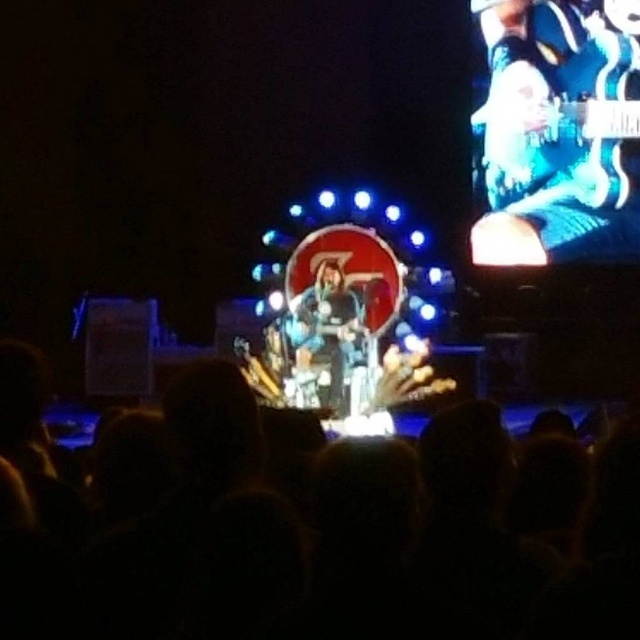
Question: Can you confirm if blue metallic guitar at upper right is positioned to the left of shiny black guitar at center?

Choices:
 (A) yes
 (B) no

Answer: (B)

Question: Among these objects, which one is farthest from the camera?

Choices:
 (A) silhouette hair at center
 (B) blue metallic guitar at upper right

Answer: (B)

Question: Does blue metallic guitar at upper right have a lesser width compared to shiny black guitar at center?

Choices:
 (A) no
 (B) yes

Answer: (A)

Question: Can you confirm if blue metallic guitar at upper right is positioned to the right of shiny black guitar at center?

Choices:
 (A) no
 (B) yes

Answer: (B)

Question: Considering the real-world distances, which object is farthest from the shiny black guitar at center?

Choices:
 (A) silhouette hair at center
 (B) blue metallic guitar at upper right

Answer: (B)

Question: Among these objects, which one is farthest from the camera?

Choices:
 (A) shiny black guitar at center
 (B) silhouette hair at center

Answer: (A)